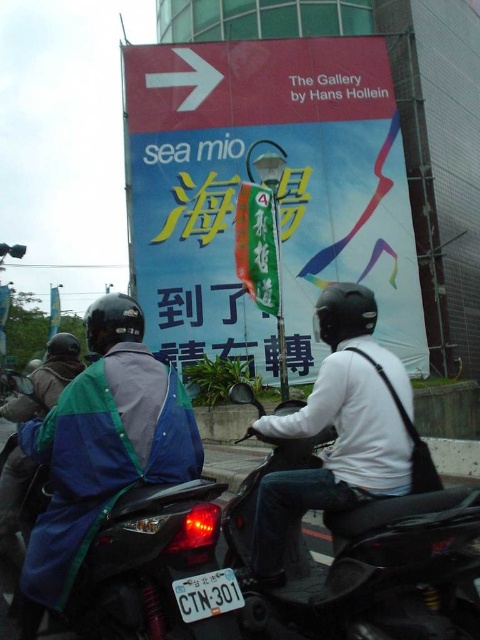
You are a delivery driver who needs to load a package onto the matte blue motorcycle at center. The package requires that it must be placed below the white matte helmet at upper center. Is the motorcycle tall enough to allow this?

The matte blue motorcycle at center has a lesser height compared to the white matte helmet at upper center, so the motorcycle is shorter than the helmet. Therefore, the package cannot be placed below the helmet as the motorcycle itself is not tall enough to accommodate this requirement.

You are a pedestrian standing at the edge of the street. You see a matte plastic signboard at center and a white matte helmet at upper center. Which object is closer to you?

The matte plastic signboard at center is closer to you because the white matte helmet at upper center is behind it.

You are a delivery rider who needs to deliver a package to the address located at the coordinates point (277, 193). You are currently riding a scooter and see the image. Which object should you look for to find the delivery location?

The delivery location at point (277, 193) is on the matte plastic signboard at center, so you should look for the matte plastic signboard at center to find the delivery location.